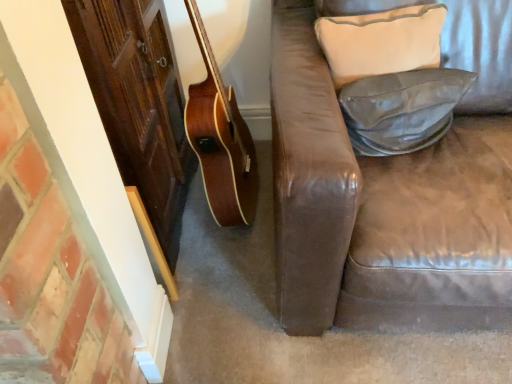
This screenshot has width=512, height=384. What do you see at coordinates (381, 41) in the screenshot?
I see `beige fabric pillow at upper right, arranged as the 1th pillow when viewed from the top` at bounding box center [381, 41].

In order to face beige fabric pillow at upper right, arranged as the 1th pillow when viewed from the top, should I rotate leftwards or rightwards?

Rotate right and turn 15.706 degrees.

In order to click on beige fabric pillow at upper right, arranged as the 1th pillow when viewed from the top in this screenshot , I will do `click(381, 41)`.

How much space does leather-like gray pillow at right, acting as the 2th pillow starting from the top, occupy horizontally?

The width of leather-like gray pillow at right, acting as the 2th pillow starting from the top, is 6.21 inches.

Find the location of a particular element. This screenshot has width=512, height=384. leather-like gray pillow at right, acting as the 2th pillow starting from the top is located at coordinates (402, 109).

This screenshot has width=512, height=384. What do you see at coordinates (402, 109) in the screenshot?
I see `leather-like gray pillow at right, acting as the 2th pillow starting from the top` at bounding box center [402, 109].

The image size is (512, 384). Identify the location of beige fabric pillow at upper right, arranged as the 1th pillow when viewed from the top. (381, 41).

Which object is positioned more to the left, beige fabric pillow at upper right, which appears as the 2th pillow when ordered from the bottom, or leather-like gray pillow at right, acting as the 2th pillow starting from the top?

beige fabric pillow at upper right, which appears as the 2th pillow when ordered from the bottom, is more to the left.

Between beige fabric pillow at upper right, arranged as the 1th pillow when viewed from the top, and leather-like gray pillow at right, acting as the 1th pillow starting from the bottom, which one is positioned in front?

Positioned in front is leather-like gray pillow at right, acting as the 1th pillow starting from the bottom.

Considering the positions of points (354, 67) and (389, 74), is point (354, 67) farther from camera compared to point (389, 74)?

No, (354, 67) is closer to viewer.

From the image's perspective, is beige fabric pillow at upper right, arranged as the 1th pillow when viewed from the top, located above leather-like gray pillow at right, acting as the 2th pillow starting from the top?

Yes, from the image's perspective, beige fabric pillow at upper right, arranged as the 1th pillow when viewed from the top, is on top of leather-like gray pillow at right, acting as the 2th pillow starting from the top.

From a real-world perspective, who is located lower, beige fabric pillow at upper right, arranged as the 1th pillow when viewed from the top, or leather-like gray pillow at right, acting as the 1th pillow starting from the bottom?

leather-like gray pillow at right, acting as the 1th pillow starting from the bottom.

Is beige fabric pillow at upper right, arranged as the 1th pillow when viewed from the top, thinner than leather-like gray pillow at right, acting as the 2th pillow starting from the top?

No, beige fabric pillow at upper right, arranged as the 1th pillow when viewed from the top, is not thinner than leather-like gray pillow at right, acting as the 2th pillow starting from the top.

In the scene shown: Is beige fabric pillow at upper right, arranged as the 1th pillow when viewed from the top, shorter than leather-like gray pillow at right, acting as the 1th pillow starting from the bottom?

No.

Considering the sizes of objects beige fabric pillow at upper right, arranged as the 1th pillow when viewed from the top, and leather-like gray pillow at right, acting as the 1th pillow starting from the bottom, in the image provided, who is bigger, beige fabric pillow at upper right, arranged as the 1th pillow when viewed from the top, or leather-like gray pillow at right, acting as the 1th pillow starting from the bottom,?

beige fabric pillow at upper right, arranged as the 1th pillow when viewed from the top, is bigger.

Is leather-like gray pillow at right, acting as the 2th pillow starting from the top, located within beige fabric pillow at upper right, arranged as the 1th pillow when viewed from the top?

That's incorrect, leather-like gray pillow at right, acting as the 2th pillow starting from the top, is not inside beige fabric pillow at upper right, arranged as the 1th pillow when viewed from the top.

Is the surface of beige fabric pillow at upper right, arranged as the 1th pillow when viewed from the top, in direct contact with leather-like gray pillow at right, acting as the 1th pillow starting from the bottom?

beige fabric pillow at upper right, arranged as the 1th pillow when viewed from the top, and leather-like gray pillow at right, acting as the 1th pillow starting from the bottom, are clearly separated.

Based on the photo, is beige fabric pillow at upper right, which appears as the 2th pillow when ordered from the bottom, looking in the opposite direction of leather-like gray pillow at right, acting as the 1th pillow starting from the bottom?

No, beige fabric pillow at upper right, which appears as the 2th pillow when ordered from the bottom, is not facing away from leather-like gray pillow at right, acting as the 1th pillow starting from the bottom.

What's the angular difference between beige fabric pillow at upper right, arranged as the 1th pillow when viewed from the top, and leather-like gray pillow at right, acting as the 1th pillow starting from the bottom,'s facing directions?

The angle between the facing direction of beige fabric pillow at upper right, arranged as the 1th pillow when viewed from the top, and the facing direction of leather-like gray pillow at right, acting as the 1th pillow starting from the bottom, is 6.28 degrees.

Locate an element on the screen. pillow that appears in front of the beige fabric pillow at upper right, which appears as the 2th pillow when ordered from the bottom is located at coordinates (402, 109).

Based on their positions, is leather-like gray pillow at right, acting as the 2th pillow starting from the top, located to the left or right of beige fabric pillow at upper right, arranged as the 1th pillow when viewed from the top?

leather-like gray pillow at right, acting as the 2th pillow starting from the top, is positioned on beige fabric pillow at upper right, arranged as the 1th pillow when viewed from the top,'s right side.

Relative to beige fabric pillow at upper right, arranged as the 1th pillow when viewed from the top, is leather-like gray pillow at right, acting as the 2th pillow starting from the top, in front or behind?

In the image, leather-like gray pillow at right, acting as the 2th pillow starting from the top, appears in front of beige fabric pillow at upper right, arranged as the 1th pillow when viewed from the top.

Is point (375, 150) closer or farther from the camera than point (341, 56)?

Point (375, 150) is positioned farther from the camera compared to point (341, 56).

From the image's perspective, is leather-like gray pillow at right, acting as the 2th pillow starting from the top, located above or below beige fabric pillow at upper right, arranged as the 1th pillow when viewed from the top?

leather-like gray pillow at right, acting as the 2th pillow starting from the top, is below beige fabric pillow at upper right, arranged as the 1th pillow when viewed from the top.

From a real-world perspective, is leather-like gray pillow at right, acting as the 1th pillow starting from the bottom, positioned over beige fabric pillow at upper right, which appears as the 2th pillow when ordered from the bottom, based on gravity?

No.

Which object is wider, leather-like gray pillow at right, acting as the 1th pillow starting from the bottom, or beige fabric pillow at upper right, which appears as the 2th pillow when ordered from the bottom?

Wider between the two is beige fabric pillow at upper right, which appears as the 2th pillow when ordered from the bottom.

Which of these two, leather-like gray pillow at right, acting as the 2th pillow starting from the top, or beige fabric pillow at upper right, arranged as the 1th pillow when viewed from the top, stands taller?

With more height is beige fabric pillow at upper right, arranged as the 1th pillow when viewed from the top.

Considering the sizes of leather-like gray pillow at right, acting as the 1th pillow starting from the bottom, and beige fabric pillow at upper right, which appears as the 2th pillow when ordered from the bottom, in the image, is leather-like gray pillow at right, acting as the 1th pillow starting from the bottom, bigger or smaller than beige fabric pillow at upper right, which appears as the 2th pillow when ordered from the bottom,?

In the image, leather-like gray pillow at right, acting as the 1th pillow starting from the bottom, appears to be smaller than beige fabric pillow at upper right, which appears as the 2th pillow when ordered from the bottom.

Is leather-like gray pillow at right, acting as the 1th pillow starting from the bottom, completely or partially outside of beige fabric pillow at upper right, which appears as the 2th pillow when ordered from the bottom?

That's correct, leather-like gray pillow at right, acting as the 1th pillow starting from the bottom, is outside of beige fabric pillow at upper right, which appears as the 2th pillow when ordered from the bottom.

Would you say leather-like gray pillow at right, acting as the 2th pillow starting from the top, is a long distance from beige fabric pillow at upper right, which appears as the 2th pillow when ordered from the bottom?

leather-like gray pillow at right, acting as the 2th pillow starting from the top, is near beige fabric pillow at upper right, which appears as the 2th pillow when ordered from the bottom, not far away.

Does leather-like gray pillow at right, acting as the 1th pillow starting from the bottom, turn towards beige fabric pillow at upper right, which appears as the 2th pillow when ordered from the bottom?

No, leather-like gray pillow at right, acting as the 1th pillow starting from the bottom, is not turned towards beige fabric pillow at upper right, which appears as the 2th pillow when ordered from the bottom.

How far apart are leather-like gray pillow at right, acting as the 1th pillow starting from the bottom, and beige fabric pillow at upper right, which appears as the 2th pillow when ordered from the bottom?

leather-like gray pillow at right, acting as the 1th pillow starting from the bottom, is 3.97 inches from beige fabric pillow at upper right, which appears as the 2th pillow when ordered from the bottom.

Find the location of a particular element. Image resolution: width=512 pixels, height=384 pixels. pillow below the beige fabric pillow at upper right, which appears as the 2th pillow when ordered from the bottom (from a real-world perspective) is located at coordinates (402, 109).

Image resolution: width=512 pixels, height=384 pixels. Find the location of `pillow located on the left of leather-like gray pillow at right, acting as the 1th pillow starting from the bottom`. pillow located on the left of leather-like gray pillow at right, acting as the 1th pillow starting from the bottom is located at coordinates (381, 41).

Identify the location of pillow located in front of the beige fabric pillow at upper right, arranged as the 1th pillow when viewed from the top. The height and width of the screenshot is (384, 512). (402, 109).